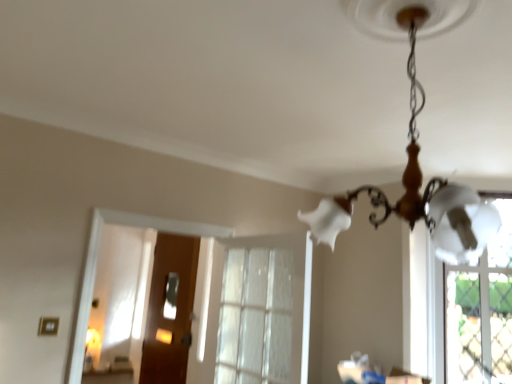
Question: Is wooden door at center facing away from white glass chandelier at upper center?

Choices:
 (A) yes
 (B) no

Answer: (B)

Question: Is white glass chandelier at upper center completely or partially inside wooden door at center?

Choices:
 (A) no
 (B) yes

Answer: (A)

Question: Is wooden door at center in contact with white glass chandelier at upper center?

Choices:
 (A) yes
 (B) no

Answer: (B)

Question: From a real-world perspective, is wooden door at center under white glass chandelier at upper center?

Choices:
 (A) no
 (B) yes

Answer: (B)

Question: Are wooden door at center and white glass chandelier at upper center located far from each other?

Choices:
 (A) no
 (B) yes

Answer: (B)

Question: From the image's perspective, would you say wooden door at center is shown under white glass chandelier at upper center?

Choices:
 (A) no
 (B) yes

Answer: (B)

Question: Can you confirm if white glass chandelier at upper center is bigger than clear glass window at center?

Choices:
 (A) no
 (B) yes

Answer: (B)

Question: Is white glass chandelier at upper center directly adjacent to clear glass window at center?

Choices:
 (A) yes
 (B) no

Answer: (B)

Question: From the image's perspective, is white glass chandelier at upper center located above clear glass window at center?

Choices:
 (A) no
 (B) yes

Answer: (B)

Question: From a real-world perspective, is white glass chandelier at upper center over clear glass window at center?

Choices:
 (A) yes
 (B) no

Answer: (A)

Question: Can you confirm if white glass chandelier at upper center is positioned to the right of clear glass window at center?

Choices:
 (A) yes
 (B) no

Answer: (A)

Question: Does white glass chandelier at upper center turn towards clear glass window at center?

Choices:
 (A) yes
 (B) no

Answer: (A)

Question: Does wooden door at center turn towards clear glass window at center?

Choices:
 (A) yes
 (B) no

Answer: (B)